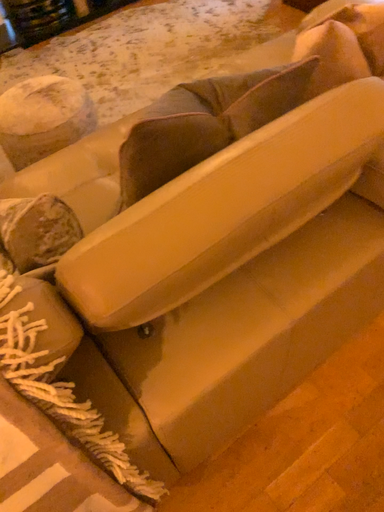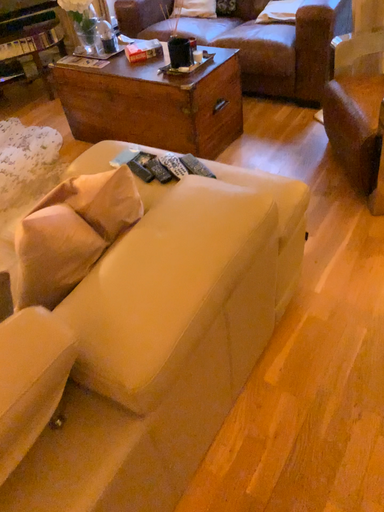
Question: How did the camera likely rotate when shooting the video?

Choices:
 (A) rotated downward
 (B) rotated upward

Answer: (B)